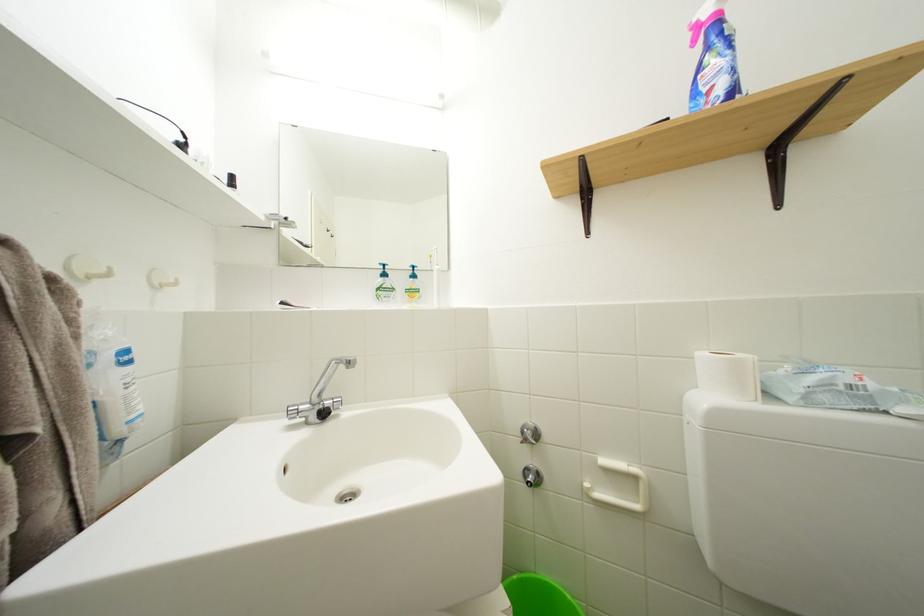
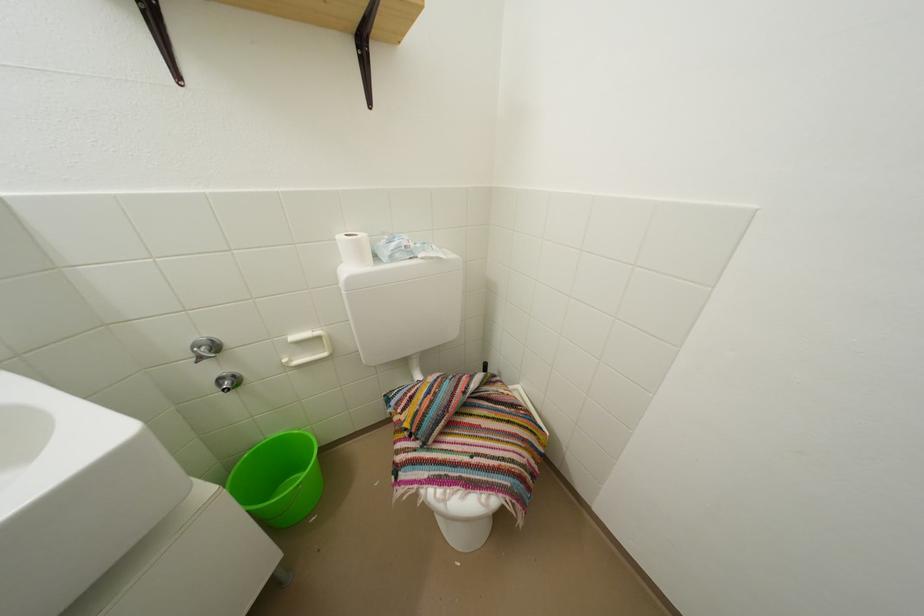
The point at (821, 385) is marked in the first image. Where is the corresponding point in the second image?

(402, 251)